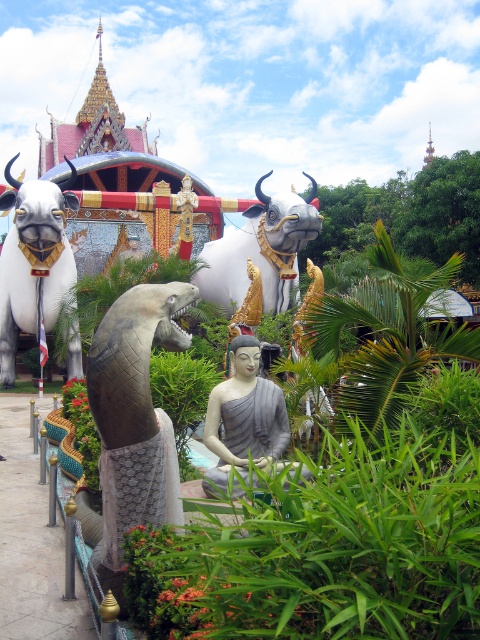
You are a visitor standing in front of the temple scene. You notice the shiny metallic snake at center and the white glossy bull at upper left. Which object is located lower in the image?

The shiny metallic snake at center is positioned under the white glossy bull at upper left, so it is located lower in the image.

You are standing in front of the temple scene described. There is a specific point marked at coordinates point (252, 253). If you want to reach this point without moving closer than 70 meters from your current position, is it possible?

The point (252, 253) is 80.18 meters away from the viewer, so yes, you can reach it without moving closer than 70 meters since it is farther away than that distance.